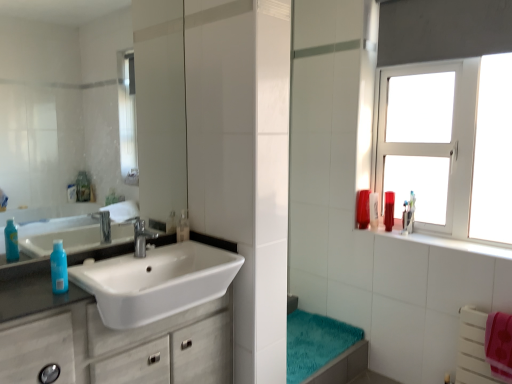
Question: Is white glossy sink at left further to the viewer compared to clear glass mirror at upper left?

Choices:
 (A) no
 (B) yes

Answer: (A)

Question: From a real-world perspective, is white glossy sink at left positioned over clear glass mirror at upper left based on gravity?

Choices:
 (A) yes
 (B) no

Answer: (B)

Question: Is white glossy sink at left smaller than clear glass mirror at upper left?

Choices:
 (A) yes
 (B) no

Answer: (B)

Question: Is white glossy sink at left completely or partially outside of clear glass mirror at upper left?

Choices:
 (A) yes
 (B) no

Answer: (A)

Question: Is white glossy sink at left shorter than clear glass mirror at upper left?

Choices:
 (A) yes
 (B) no

Answer: (A)

Question: Is white glossy sink at left facing towards clear glass mirror at upper left?

Choices:
 (A) yes
 (B) no

Answer: (B)

Question: From a real-world perspective, does white matte cabinet at left sit lower than translucent plastic mouthwash at right, acting as the 2th mouthwash starting from the back?

Choices:
 (A) no
 (B) yes

Answer: (B)

Question: Would you say white matte cabinet at left is outside translucent plastic mouthwash at right, the 3th mouthwash when ordered from front to back?

Choices:
 (A) yes
 (B) no

Answer: (A)

Question: From the image's perspective, is white matte cabinet at left below translucent plastic mouthwash at right, the 2th mouthwash viewed from the right?

Choices:
 (A) no
 (B) yes

Answer: (B)

Question: Is white matte cabinet at left aimed at translucent plastic mouthwash at right, acting as the 2th mouthwash starting from the back?

Choices:
 (A) yes
 (B) no

Answer: (B)

Question: Does white matte cabinet at left come in front of translucent plastic mouthwash at right, the 2th mouthwash viewed from the right?

Choices:
 (A) no
 (B) yes

Answer: (B)

Question: Does white matte cabinet at left have a greater width compared to translucent plastic mouthwash at right, acting as the 2th mouthwash starting from the back?

Choices:
 (A) yes
 (B) no

Answer: (A)

Question: Is clear glass mirror at upper left oriented away from teal plush bath towel at lower center?

Choices:
 (A) yes
 (B) no

Answer: (B)